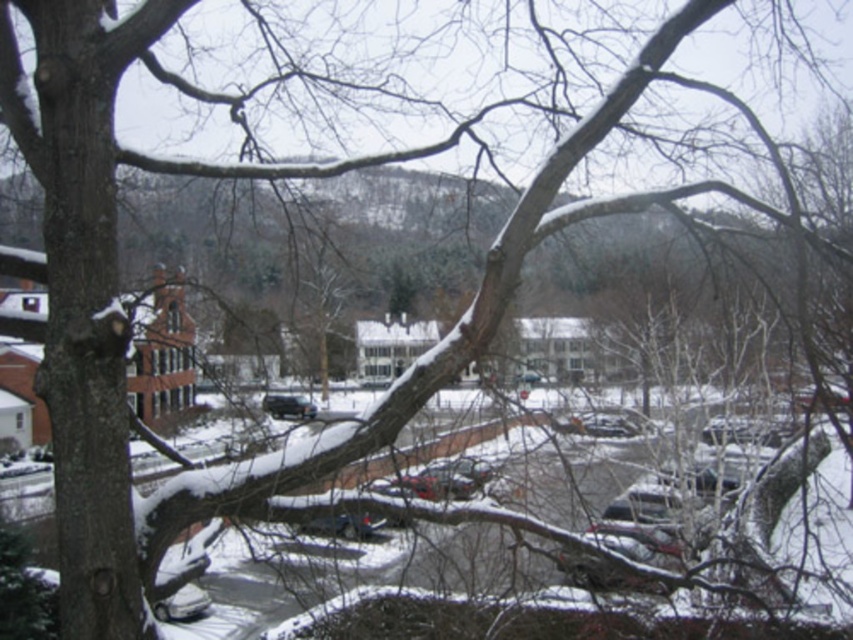
Is metallic silver car at lower left positioned at the back of satin black car at center?

No, metallic silver car at lower left is in front of satin black car at center.

Between metallic silver car at lower left and satin black car at center, which one is positioned lower?

Positioned lower is metallic silver car at lower left.

The height and width of the screenshot is (640, 853). I want to click on metallic silver car at lower left, so click(x=183, y=604).

The width and height of the screenshot is (853, 640). I want to click on metallic silver car at lower left, so 183,604.